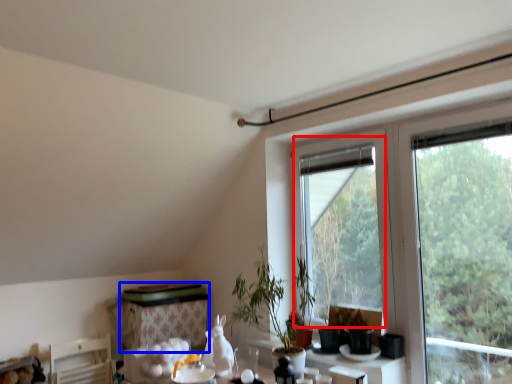
Question: Among these objects, which one is farthest to the camera, bay window (highlighted by a red box) or table (highlighted by a blue box)?

Choices:
 (A) bay window
 (B) table

Answer: (B)